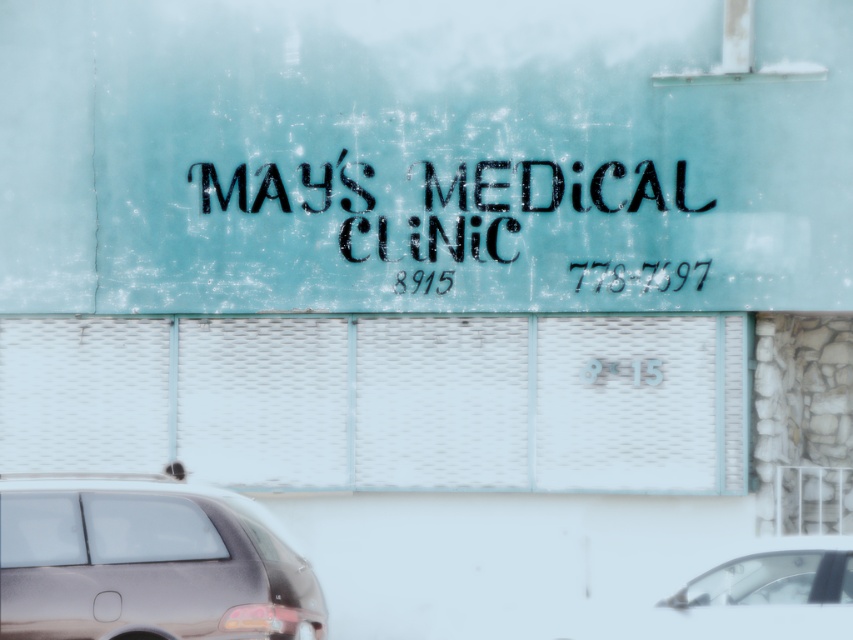
Between shiny metallic car at lower left and black stenciled text at center, which one has more height?

black stenciled text at center is taller.

Is point (165, 568) positioned behind point (341, 154)?

That is False.

Is point (137, 522) positioned after point (367, 202)?

No, it is in front of (367, 202).

At what (x,y) coordinates should I click in order to perform the action: click on shiny metallic car at lower left. Please return your answer as a coordinate pair (x, y). Image resolution: width=853 pixels, height=640 pixels. Looking at the image, I should click on (146, 563).

Is point (474, 163) closer to viewer compared to point (850, 572)?

No, it is not.

Who is positioned more to the left, black stenciled text at center or metallic silver car at lower right?

black stenciled text at center

Between point (415, 177) and point (834, 573), which one is positioned in front?

Point (834, 573) is in front.

Image resolution: width=853 pixels, height=640 pixels. Identify the location of black stenciled text at center. (445, 202).

Who is shorter, shiny metallic car at lower left or metallic silver car at lower right?

With less height is metallic silver car at lower right.

Is shiny metallic car at lower left in front of metallic silver car at lower right?

Yes, it is.

This screenshot has height=640, width=853. In order to click on shiny metallic car at lower left in this screenshot , I will do `click(146, 563)`.